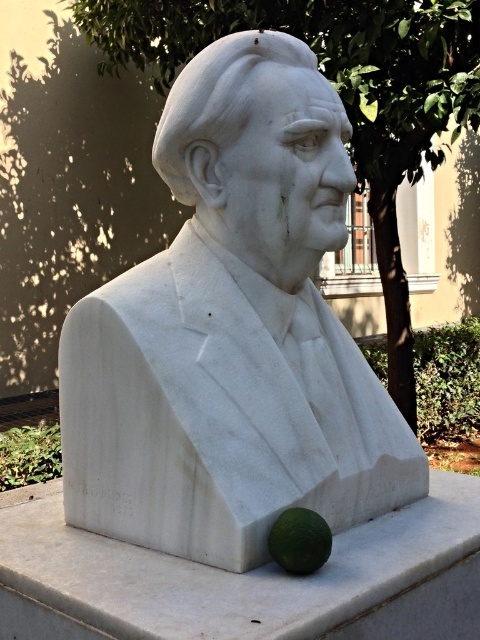
You are an artist planning to create a miniature version of this sculpture setup. You need to know the relative sizes of the objects to scale them correctly. Which object is wider between the white marble bust at center and the green matte lime at lower center?

The white marble bust at center is wider than the green matte lime at lower center according to the description.

You are an art conservator assessing the stability of the white marble bust at center and the white marble sphere at lower right. Which object is more likely to remain stable due to its height?

The white marble bust at center is much taller than the white marble sphere at lower right, so it has a lower center of gravity and is more stable.

You are an art student analyzing the composition of the scene. The coordinates given are part of your analysis. Which object in the scene is located at the coordinates point (232, 332)?

The point (232, 332) indicates the location of the white marble bust at center.